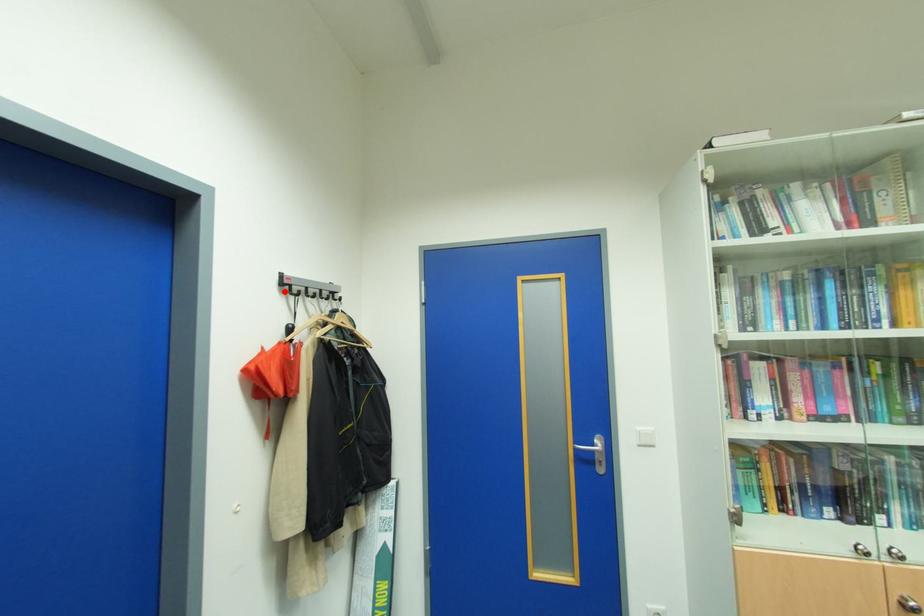
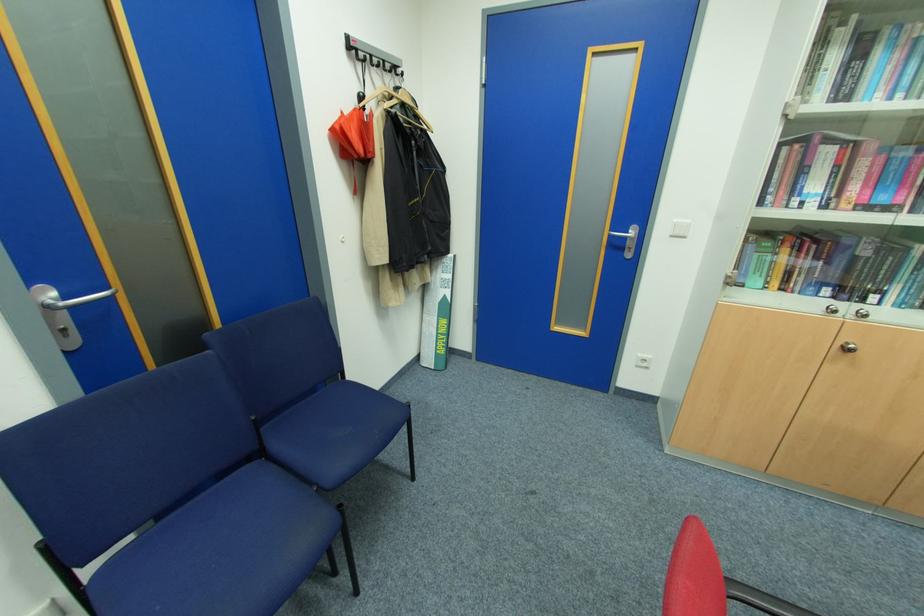
Locate, in the second image, the point that corresponds to the highlighted location in the first image.

(353, 55)